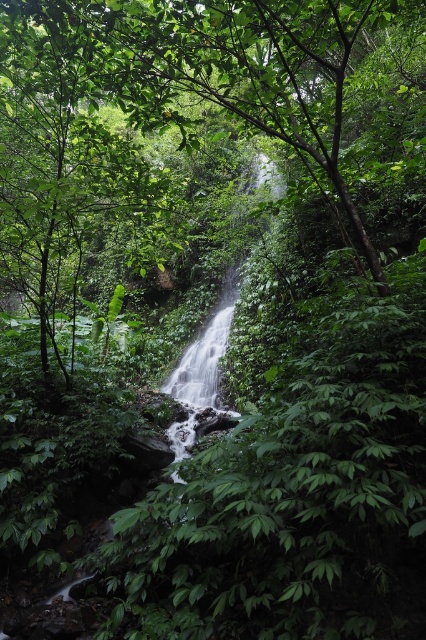
Measure the distance between green leafy tree at center and green leafy waterfall at center.

green leafy tree at center and green leafy waterfall at center are 16.15 feet apart from each other.

Is point (333, 195) farther from viewer compared to point (215, 380)?

No, (333, 195) is in front of (215, 380).

I want to click on green leafy tree at center, so click(x=189, y=115).